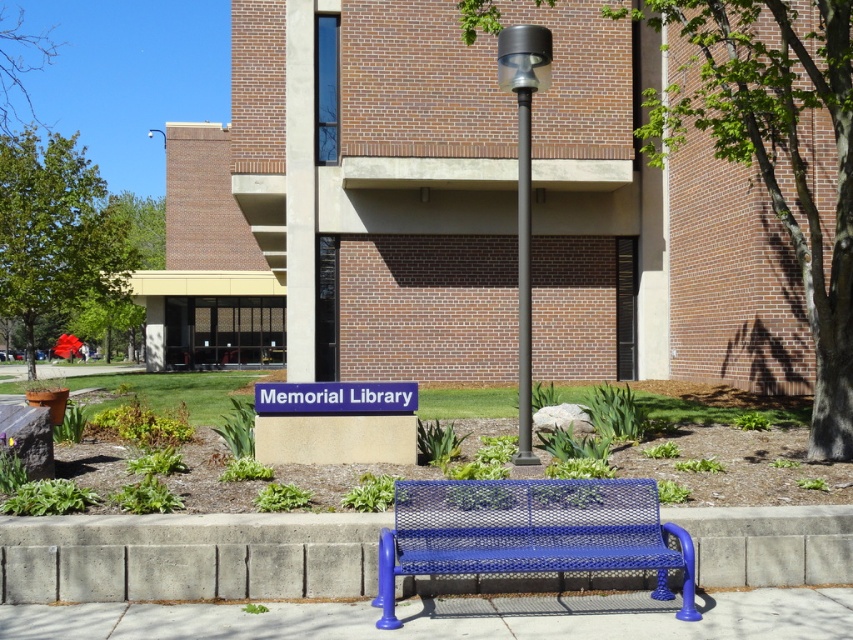
Is metallic blue bench at center to the right of black metal pole at center from the viewer's perspective?

In fact, metallic blue bench at center is to the left of black metal pole at center.

The width and height of the screenshot is (853, 640). What are the coordinates of `metallic blue bench at center` in the screenshot? It's located at (529, 532).

Is point (444, 572) positioned before point (525, 220)?

Yes, point (444, 572) is closer to viewer.

This screenshot has width=853, height=640. Identify the location of metallic blue bench at center. (529, 532).

Can you confirm if metallic blue bench at center is bigger than blue plastic sign at center?

Yes.

How distant is metallic blue bench at center from blue plastic sign at center?

10.21 feet

Does point (502, 524) come in front of point (344, 406)?

That is True.

Where is `metallic blue bench at center`? The image size is (853, 640). metallic blue bench at center is located at coordinates (529, 532).

Between black metal pole at center and blue plastic sign at center, which one appears on the right side from the viewer's perspective?

black metal pole at center

Can you confirm if black metal pole at center is positioned to the right of blue plastic sign at center?

Indeed, black metal pole at center is positioned on the right side of blue plastic sign at center.

Find the location of `black metal pole at center`. black metal pole at center is located at coordinates (524, 189).